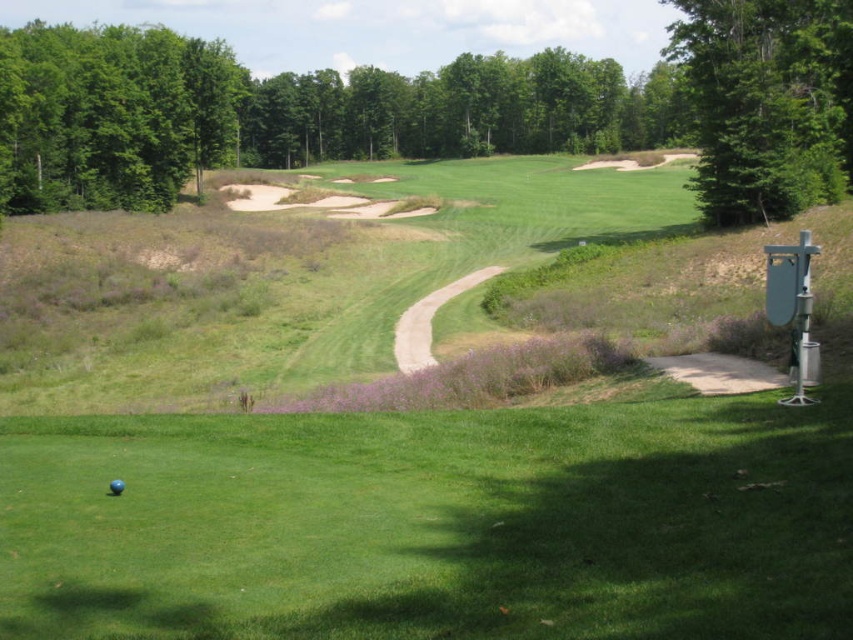
Does point (766, 65) come farther from viewer compared to point (114, 483)?

Yes.

The width and height of the screenshot is (853, 640). What do you see at coordinates (766, 104) in the screenshot?
I see `green leafy tree at upper right` at bounding box center [766, 104].

Locate an element on the screen. This screenshot has width=853, height=640. green leafy tree at upper right is located at coordinates (766, 104).

Can you confirm if green leafy tree at upper left is positioned to the left of blue matte golf ball at lower left?

Yes, green leafy tree at upper left is to the left of blue matte golf ball at lower left.

Does green leafy tree at upper left have a lesser width compared to blue matte golf ball at lower left?

Incorrect, green leafy tree at upper left's width is not less than blue matte golf ball at lower left's.

You are a GUI agent. You are given a task and a screenshot of the screen. Output one action in this format:
    pyautogui.click(x=<x>, y=<y>)
    Task: Click on the green leafy tree at upper left
    This screenshot has width=853, height=640.
    Given the screenshot: What is the action you would take?
    pyautogui.click(x=111, y=115)

Can you confirm if green leafy tree at upper left is shorter than green leafy tree at upper right?

No.

In order to click on green leafy tree at upper left in this screenshot , I will do `click(111, 115)`.

This screenshot has height=640, width=853. What are the coordinates of `green leafy tree at upper left` in the screenshot? It's located at tap(111, 115).